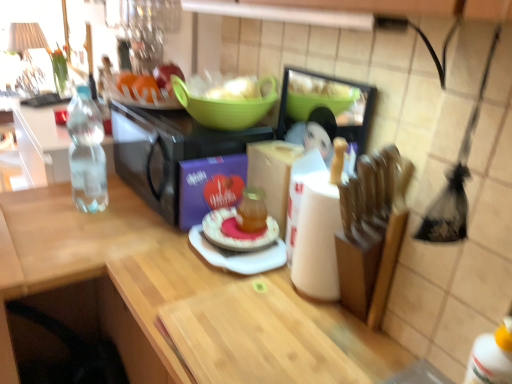
Where is `vacant area in front of clear plastic bottle at left`? vacant area in front of clear plastic bottle at left is located at coordinates (67, 231).